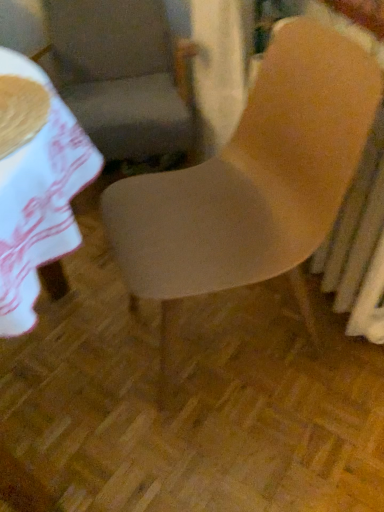
Question: In which direction should I rotate to look at matte gray chair at center, which is the second chair in front-to-back order?

Choices:
 (A) left
 (B) right

Answer: (A)

Question: Is matte gray chair at center, which is the 1th chair in back-to-front order, shorter than matte wood chair at center, which appears as the 1th chair when viewed from the front?

Choices:
 (A) no
 (B) yes

Answer: (B)

Question: Considering the relative positions of matte gray chair at center, which is the second chair in front-to-back order, and matte wood chair at center, the second chair positioned from the back, in the image provided, is matte gray chair at center, which is the second chair in front-to-back order, to the right of matte wood chair at center, the second chair positioned from the back, from the viewer's perspective?

Choices:
 (A) yes
 (B) no

Answer: (B)

Question: Is matte gray chair at center, which is the 1th chair in back-to-front order, turned away from matte wood chair at center, which appears as the 1th chair when viewed from the front?

Choices:
 (A) yes
 (B) no

Answer: (B)

Question: Does matte gray chair at center, which is the second chair in front-to-back order, turn towards matte wood chair at center, the second chair positioned from the back?

Choices:
 (A) yes
 (B) no

Answer: (A)

Question: Is matte gray chair at center, which is the second chair in front-to-back order, not close to matte wood chair at center, the second chair positioned from the back?

Choices:
 (A) yes
 (B) no

Answer: (B)

Question: Is matte gray chair at center, which is the 1th chair in back-to-front order, wider than matte wood chair at center, which appears as the 1th chair when viewed from the front?

Choices:
 (A) no
 (B) yes

Answer: (B)

Question: From the image's perspective, is matte wood chair at center, which appears as the 1th chair when viewed from the front, under matte gray chair at center, which is the second chair in front-to-back order?

Choices:
 (A) no
 (B) yes

Answer: (B)

Question: Can you confirm if matte wood chair at center, which appears as the 1th chair when viewed from the front, is wider than matte gray chair at center, which is the second chair in front-to-back order?

Choices:
 (A) yes
 (B) no

Answer: (B)

Question: From a real-world perspective, is matte wood chair at center, which appears as the 1th chair when viewed from the front, below matte gray chair at center, which is the 1th chair in back-to-front order?

Choices:
 (A) no
 (B) yes

Answer: (A)

Question: Is matte wood chair at center, which appears as the 1th chair when viewed from the front, oriented towards matte gray chair at center, which is the second chair in front-to-back order?

Choices:
 (A) no
 (B) yes

Answer: (A)

Question: Does matte wood chair at center, the second chair positioned from the back, have a smaller size compared to matte gray chair at center, which is the 1th chair in back-to-front order?

Choices:
 (A) yes
 (B) no

Answer: (A)

Question: Could matte gray chair at center, which is the second chair in front-to-back order, be considered to be inside matte wood chair at center, the second chair positioned from the back?

Choices:
 (A) no
 (B) yes

Answer: (A)

Question: Based on their sizes in the image, would you say matte wood chair at center, the second chair positioned from the back, is bigger or smaller than matte gray chair at center, which is the 1th chair in back-to-front order?

Choices:
 (A) big
 (B) small

Answer: (B)